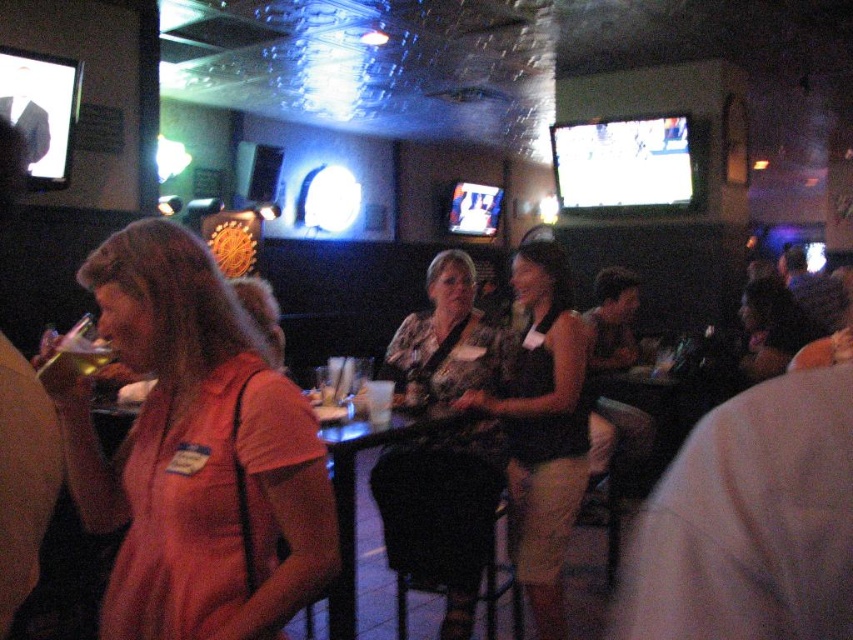
Does orange fabric shirt at left have a larger size compared to floral-patterned blouse at center?

Incorrect, orange fabric shirt at left is not larger than floral-patterned blouse at center.

Is point (180, 323) closer to viewer compared to point (467, 385)?

Yes.

The height and width of the screenshot is (640, 853). Identify the location of orange fabric shirt at left. (196, 452).

Can you confirm if orange fabric shirt at left is positioned to the left of matte black tank top at center?

Indeed, orange fabric shirt at left is positioned on the left side of matte black tank top at center.

Is point (233, 563) behind point (561, 589)?

No, it is in front of (561, 589).

Identify the location of orange fabric shirt at left. (196, 452).

Locate an element on the screen. Image resolution: width=853 pixels, height=640 pixels. orange fabric shirt at left is located at coordinates (196, 452).

Is floral-patterned blouse at center positioned behind matte black tank top at center?

No.

Does floral-patterned blouse at center have a larger size compared to matte black tank top at center?

Indeed, floral-patterned blouse at center has a larger size compared to matte black tank top at center.

Who is more forward, (410,392) or (514,417)?

Point (514,417) is more forward.

The width and height of the screenshot is (853, 640). In order to click on floral-patterned blouse at center in this screenshot , I will do `click(440, 513)`.